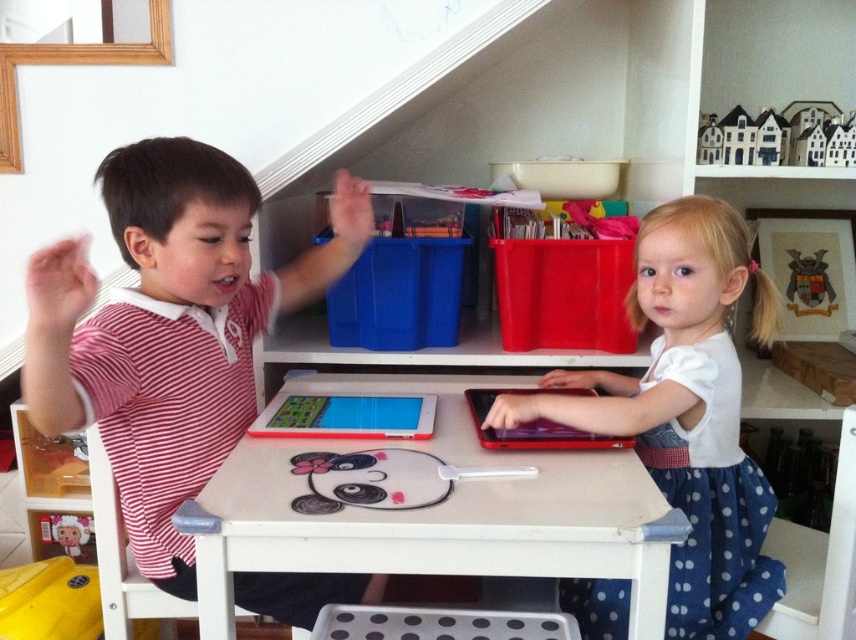
Does metallic shield at upper right appear on the right side of plush doll at lower left?

Yes, metallic shield at upper right is to the right of plush doll at lower left.

Who is more forward, (789, 266) or (76, 548)?

Positioned in front is point (76, 548).

At what (x,y) coordinates should I click in order to perform the action: click on metallic shield at upper right. Please return your answer as a coordinate pair (x, y). Looking at the image, I should click on (809, 284).

Does striped cotton shirt at left have a greater width compared to white painted wood table at center?

In fact, striped cotton shirt at left might be narrower than white painted wood table at center.

Between striped cotton shirt at left and white painted wood table at center, which one has less height?

Standing shorter between the two is white painted wood table at center.

At what (x,y) coordinates should I click in order to perform the action: click on striped cotton shirt at left. Please return your answer as a coordinate pair (x, y). The image size is (856, 640). Looking at the image, I should click on (169, 330).

Locate an element on the screen. This screenshot has height=640, width=856. striped cotton shirt at left is located at coordinates (169, 330).

Does white matte dress at right appear under plush doll at lower left?

Actually, white matte dress at right is above plush doll at lower left.

Can you confirm if white matte dress at right is positioned to the right of plush doll at lower left?

Correct, you'll find white matte dress at right to the right of plush doll at lower left.

Between point (524, 401) and point (69, 547), which one is positioned in front?

Point (524, 401) is more forward.

At what (x,y) coordinates should I click in order to perform the action: click on white matte dress at right. Please return your answer as a coordinate pair (x, y). This screenshot has height=640, width=856. Looking at the image, I should click on (687, 413).